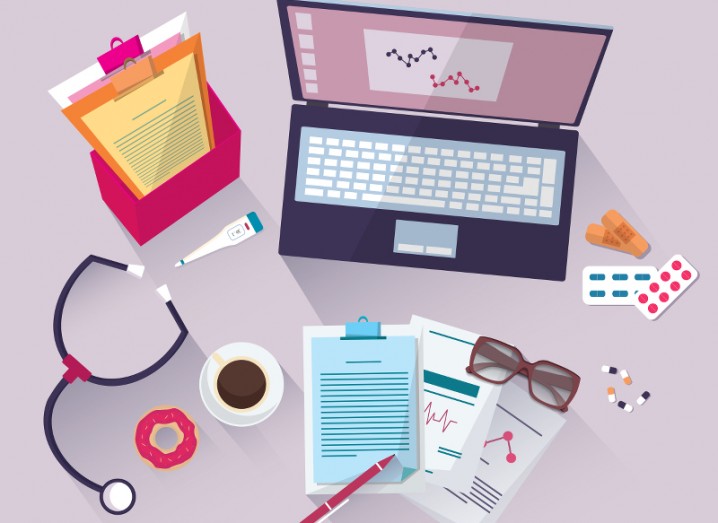
In order to click on papers in this screenshot , I will do `click(512, 423)`, `click(467, 469)`, `click(378, 410)`, `click(136, 120)`, `click(95, 86)`.